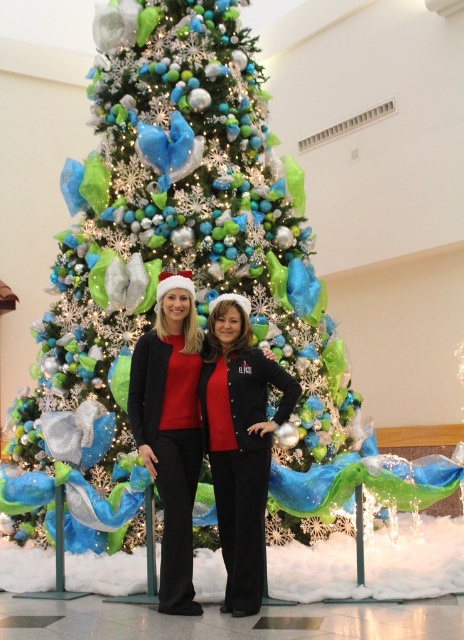
You are a photographer setting up for a holiday photo shoot. You need to ensure that both the shiny metallic christmas tree at center and the black matte jacket at center are fully visible in the frame. Based on their heights, which object should you adjust the camera angle to focus on first to capture both effectively?

The shiny metallic christmas tree at center is shorter than the black matte jacket at center. To capture both effectively, adjust the camera angle to focus on the taller object first, which is the black matte jacket at center, then ensure the shorter tree is fully visible in the frame.

You are standing in front of the Christmas tree and want to place a gift at point (26, 493) and another gift at point (232, 317). Which gift will be closer to the tree?

The gift placed at point (232, 317) will be closer to the tree because point (26, 493) is behind point (232, 317).

Based on the scene description, where is the point labeled as point (x=174, y=269) located?

The point labeled point (x=174, y=269) is located on the shiny metallic christmas tree at center.